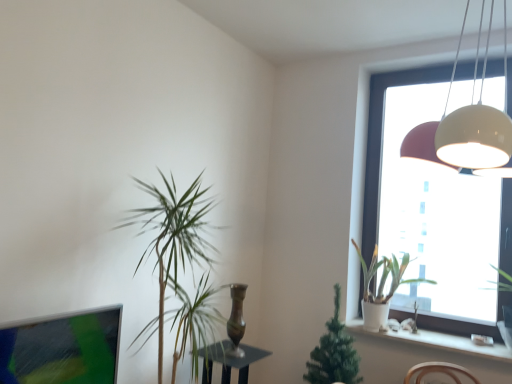
Question: Does point (506, 334) appear closer or farther from the camera than point (374, 321)?

Choices:
 (A) farther
 (B) closer

Answer: (B)

Question: Visually, is green leafy plant at window, which is the first houseplant from right to left, positioned to the left or to the right of white matte pot at window, arranged as the second houseplant when viewed from the left?

Choices:
 (A) right
 (B) left

Answer: (A)

Question: Which is farther from the bronze metallic vase at center?

Choices:
 (A) matte white pendant light at upper right
 (B) green leafy plant at window, positioned as the third houseplant in left-to-right order
 (C) white ceramic pot at lower right
 (D) white glossy window at upper right
 (E) green leafy plant at left, which is the first houseplant from left to right

Answer: (B)

Question: Which of these objects is positioned closest to the matte white pendant light at upper right?

Choices:
 (A) bronze metallic vase at center
 (B) green leafy plant at window, which is the first houseplant from right to left
 (C) white ceramic pot at lower right
 (D) white matte pot at window, which is counted as the 2th houseplant, starting from the right
 (E) white glossy window at upper right

Answer: (A)